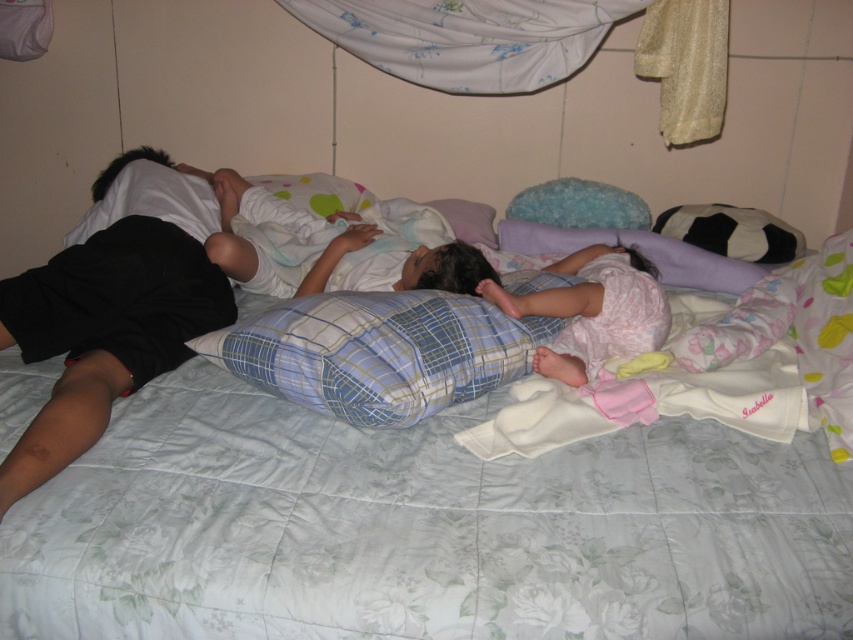
Does matte black pillow at left have a greater height compared to white soft blanket at center?

Yes.

Is matte black pillow at left above white soft blanket at center?

Yes.

Does point (107, 266) come farther from viewer compared to point (805, 342)?

No.

I want to click on matte black pillow at left, so click(x=117, y=307).

Is white soft pillow at center shorter than purple soft pillow at center?

No, white soft pillow at center is not shorter than purple soft pillow at center.

Which is more to the left, white soft pillow at center or purple soft pillow at center?

white soft pillow at center

Which is in front, point (358, 246) or point (519, 248)?

Point (358, 246) is in front.

The image size is (853, 640). I want to click on white soft pillow at center, so click(x=326, y=250).

Can you confirm if white floral bedspread at center is positioned to the left of white soft blanket at center?

Yes, white floral bedspread at center is to the left of white soft blanket at center.

Which is above, white floral bedspread at center or white soft blanket at center?

white soft blanket at center

Between point (621, 600) and point (782, 305), which one is positioned in front?

Positioned in front is point (621, 600).

You are a GUI agent. You are given a task and a screenshot of the screen. Output one action in this format:
    pyautogui.click(x=<x>, y=<y>)
    Task: Click on the white floral bedspread at center
    
    Given the screenshot: What is the action you would take?
    pyautogui.click(x=421, y=529)